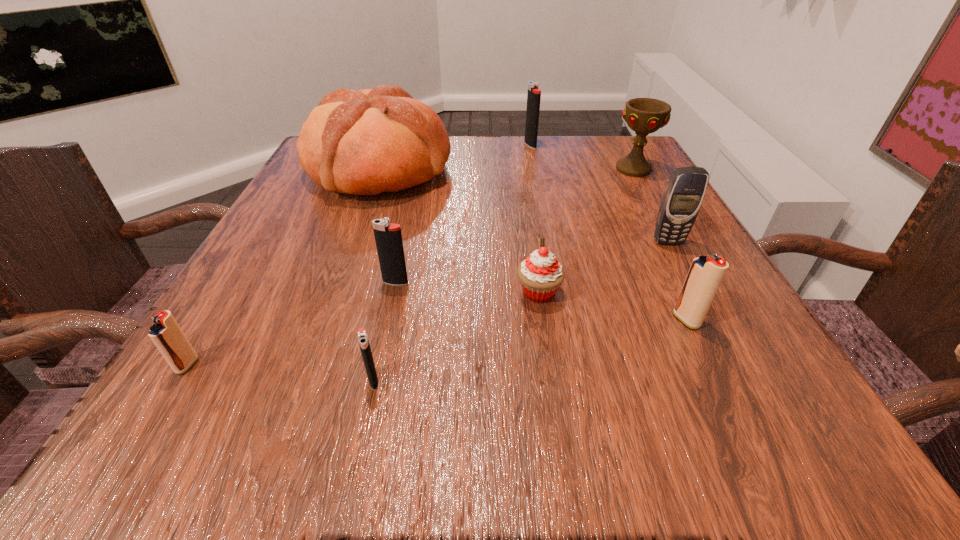
Identify the location of the smaller red igniter. (166, 334).

Locate an element on the screen. The width and height of the screenshot is (960, 540). the leftmost igniter is located at coordinates (166, 334).

Image resolution: width=960 pixels, height=540 pixels. I want to click on the nearest black igniter, so click(x=362, y=337).

The image size is (960, 540). What are the coordinates of `free space located 0.380m on the front of the bread` in the screenshot? It's located at (x=309, y=361).

I want to click on blank area located on the front of the biggest black igniter, so click(539, 188).

Image resolution: width=960 pixels, height=540 pixels. What are the coordinates of `vacant space located 0.260m on the left of the red chalice` in the screenshot? It's located at (496, 170).

Locate an element on the screen. This screenshot has width=960, height=540. vacant space located on the front face of the sixth nearest object is located at coordinates (749, 392).

The height and width of the screenshot is (540, 960). I want to click on vacant point located 0.340m on the back of the second smallest black igniter, so click(x=419, y=177).

The image size is (960, 540). I want to click on blank area located 0.330m on the back of the farther red igniter, so click(627, 195).

At what (x,y) coordinates should I click in order to perform the action: click on vacant space situated on the front of the pink cupcake. Please return your answer as a coordinate pair (x, y). The height and width of the screenshot is (540, 960). Looking at the image, I should click on (559, 432).